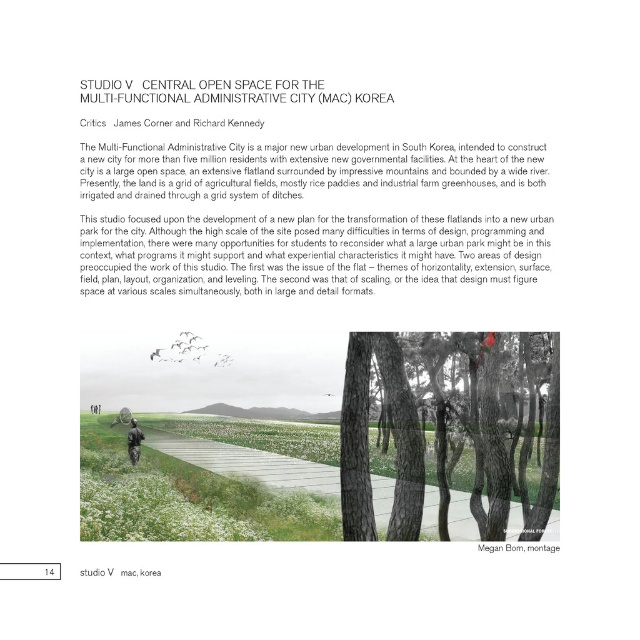
Question: Which of the following is the farthest from the observer?

Choices:
 (A) 493,456
 (B) 486,506
 (C) 132,432

Answer: (C)

Question: Which object is positioned farthest from the green grass at lower center?

Choices:
 (A) smooth bark tree at center
 (B) matte black person at center

Answer: (A)

Question: Is green grass at lower center smaller than matte black person at center?

Choices:
 (A) yes
 (B) no

Answer: (B)

Question: Considering the real-world distances, which object is farthest from the matte black person at center?

Choices:
 (A) smooth bark tree at center
 (B) green grass at lower center

Answer: (A)

Question: Does smooth bark tree at center appear on the right side of matte black person at center?

Choices:
 (A) yes
 (B) no

Answer: (A)

Question: Is green grass at lower center above matte black person at center?

Choices:
 (A) yes
 (B) no

Answer: (B)